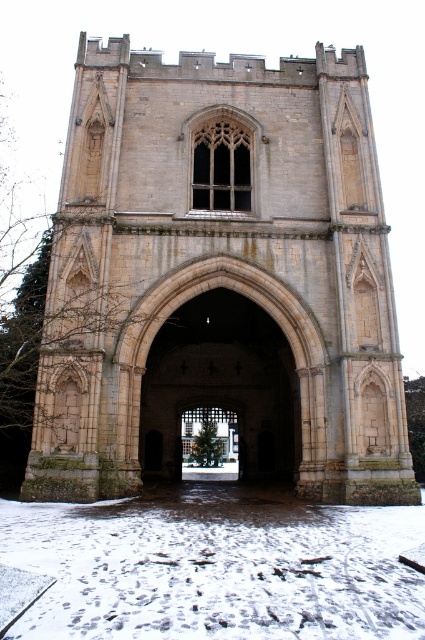
Looking at this image, you are standing in front of the medieval archway and see the white powdery snow at lower center and the green matte christmas tree at center. Which object is located higher in the image?

The white powdery snow at lower center is positioned over the green matte christmas tree at center, so it is higher.

You are standing in front of the light brown stone church at center and want to walk to the white powdery snow at lower center. Which direction should you move relative to the church?

You should move to the left relative to the light brown stone church at center because the white powdery snow at lower center is positioned on the left side of the church.

You are standing in front of a grand medieval stone archway. There is a point marked at coordinates point (223, 276). Based on the scene description, can you identify what architectural feature this point is located on?

The point (223, 276) is on the light brown stone church at center, which is the central archway of the medieval structure.